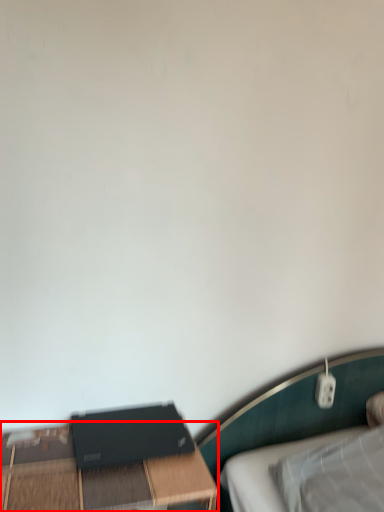
Question: Considering the relative positions of table (annotated by the red box) and computer in the image provided, where is table (annotated by the red box) located with respect to the staircase?

Choices:
 (A) left
 (B) right

Answer: (A)